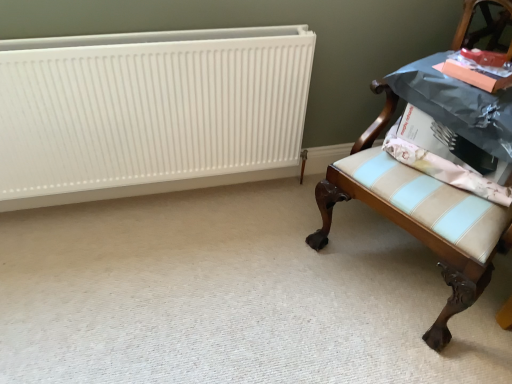
Question: Is white matte radiator at upper left not within wooden upholstered chair at right?

Choices:
 (A) no
 (B) yes

Answer: (B)

Question: Can you confirm if white matte radiator at upper left is taller than wooden upholstered chair at right?

Choices:
 (A) no
 (B) yes

Answer: (A)

Question: Would you consider white matte radiator at upper left to be distant from wooden upholstered chair at right?

Choices:
 (A) yes
 (B) no

Answer: (B)

Question: From the image's perspective, would you say white matte radiator at upper left is shown under wooden upholstered chair at right?

Choices:
 (A) yes
 (B) no

Answer: (B)

Question: From the image's perspective, is white matte radiator at upper left above wooden upholstered chair at right?

Choices:
 (A) no
 (B) yes

Answer: (B)

Question: Considering the positions of white matte radiator at upper left and wooden upholstered chair at right in the image, is white matte radiator at upper left bigger or smaller than wooden upholstered chair at right?

Choices:
 (A) small
 (B) big

Answer: (A)

Question: From a real-world perspective, is white matte radiator at upper left physically located above or below wooden upholstered chair at right?

Choices:
 (A) above
 (B) below

Answer: (B)

Question: From the image's perspective, relative to wooden upholstered chair at right, is white matte radiator at upper left above or below?

Choices:
 (A) below
 (B) above

Answer: (B)

Question: Which is correct: white matte radiator at upper left is inside wooden upholstered chair at right, or outside of it?

Choices:
 (A) outside
 (B) inside

Answer: (A)

Question: Based on their sizes in the image, would you say light blue striped fabric at right is bigger or smaller than white matte radiator at upper left?

Choices:
 (A) small
 (B) big

Answer: (A)

Question: From a real-world perspective, is light blue striped fabric at right physically located above or below white matte radiator at upper left?

Choices:
 (A) above
 (B) below

Answer: (A)

Question: Considering the positions of light blue striped fabric at right and white matte radiator at upper left in the image, is light blue striped fabric at right wider or thinner than white matte radiator at upper left?

Choices:
 (A) thin
 (B) wide

Answer: (B)

Question: Does point (498, 193) appear closer or farther from the camera than point (109, 39)?

Choices:
 (A) closer
 (B) farther

Answer: (A)

Question: Considering their positions, is light blue striped fabric at right located in front of or behind wooden upholstered chair at right?

Choices:
 (A) front
 (B) behind

Answer: (B)

Question: In terms of height, does light blue striped fabric at right look taller or shorter compared to wooden upholstered chair at right?

Choices:
 (A) short
 (B) tall

Answer: (A)